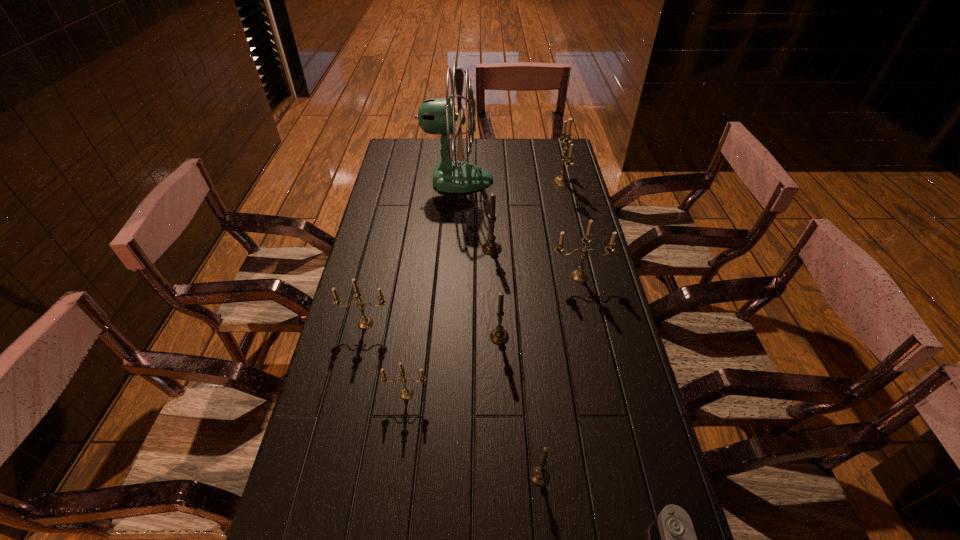
Where is `candle that is the second closest to the second smallest metallic candle`? This screenshot has height=540, width=960. candle that is the second closest to the second smallest metallic candle is located at coordinates (499, 335).

The image size is (960, 540). Find the location of `the closest metallic candle to the nearest gray candle`. the closest metallic candle to the nearest gray candle is located at coordinates (406, 393).

Locate which metallic candle is the fourth closest to the teal fan. Please provide its 2D coordinates. Your answer should be formatted as a tuple, i.e. [(x, y)], where the tuple contains the x and y coordinates of a point satisfying the conditions above.

[(406, 393)]

At what (x,y) coordinates should I click in order to perform the action: click on gray candle that stands as the second closest to the sixth object from left to right. Please return your answer as a coordinate pair (x, y). This screenshot has height=540, width=960. Looking at the image, I should click on (491, 247).

Select which gray candle appears as the second closest to the third farthest metallic candle. Please provide its 2D coordinates. Your answer should be formatted as a tuple, i.e. [(x, y)], where the tuple contains the x and y coordinates of a point satisfying the conditions above.

[(491, 247)]

I want to click on vacant region that satisfies the following two spatial constraints: 1. on the front side of the second metallic candle from left to right; 2. on the right side of the smallest gray candle, so [396, 476].

Locate an element on the screen. The height and width of the screenshot is (540, 960). vacant region that satisfies the following two spatial constraints: 1. on the back side of the second biggest metallic candle; 2. on the right side of the tallest candle is located at coordinates (558, 182).

The height and width of the screenshot is (540, 960). Find the location of `blank area in the image that satisfies the following two spatial constraints: 1. on the back side of the third nearest metallic candle; 2. in front of the teal fan, directing airflow`. blank area in the image that satisfies the following two spatial constraints: 1. on the back side of the third nearest metallic candle; 2. in front of the teal fan, directing airflow is located at coordinates (558, 180).

Where is `free space that satisfies the following two spatial constraints: 1. on the back side of the smallest metallic candle; 2. on the right side of the sixth nearest candle`? Image resolution: width=960 pixels, height=540 pixels. free space that satisfies the following two spatial constraints: 1. on the back side of the smallest metallic candle; 2. on the right side of the sixth nearest candle is located at coordinates (426, 248).

Locate an element on the screen. The height and width of the screenshot is (540, 960). vacant space that satisfies the following two spatial constraints: 1. on the back side of the sixth nearest candle; 2. on the left side of the farthest metallic candle is located at coordinates (490, 182).